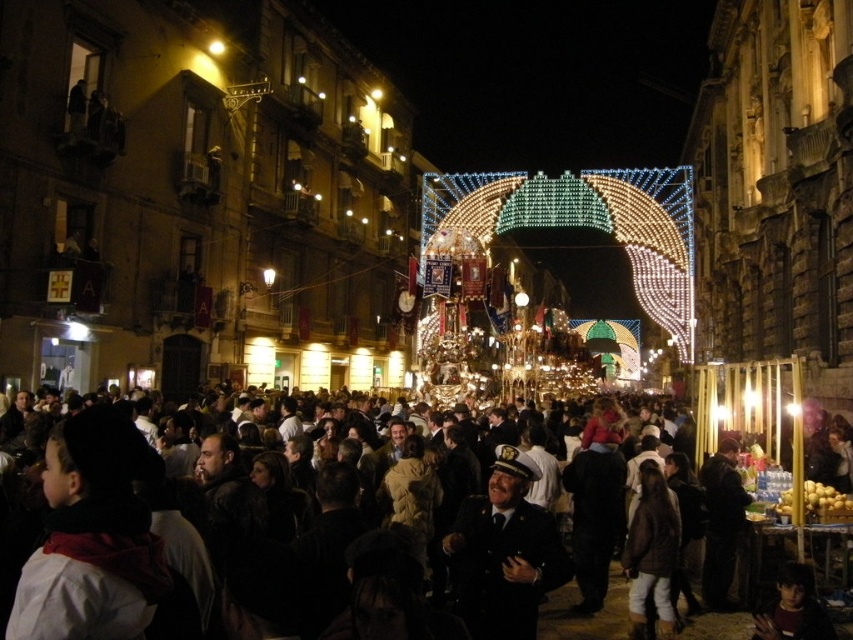
Which is more to the right, black uniform at center or dark brown fabric crowd at center?

Positioned to the right is black uniform at center.

Between point (460, 525) and point (694, 636), which one is positioned behind?

Positioned behind is point (460, 525).

Where is `black uniform at center`? This screenshot has height=640, width=853. black uniform at center is located at coordinates (503, 552).